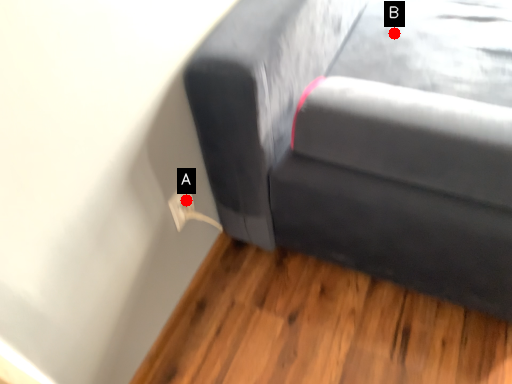
Question: Two points are circled on the image, labeled by A and B beside each circle. Which point appears farthest from the camera in this image?

Choices:
 (A) A is further
 (B) B is further

Answer: (B)